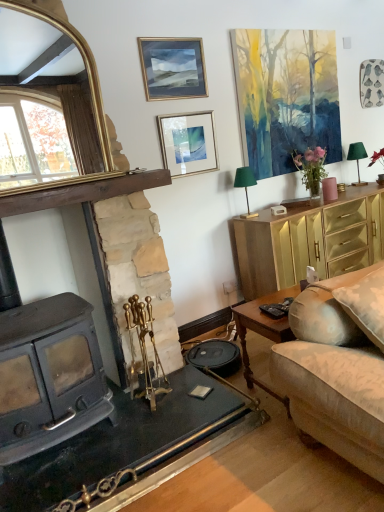
Looking at this image, measure the distance between black plastic remote control at lower right and camera.

A distance of 2.04 meters exists between black plastic remote control at lower right and camera.

Locate an element on the screen. black plastic remote control at lower right is located at coordinates (273, 310).

At what (x,y) coordinates should I click in order to perform the action: click on matte silver picture frame at upper center, which ranks as the second picture frame in left-to-right order. Please return your answer as a coordinate pair (x, y). Looking at the image, I should click on (188, 143).

What is the approximate width of pink matte vase at upper right?

The width of pink matte vase at upper right is 26.46 centimeters.

This screenshot has width=384, height=512. What do you see at coordinates (286, 96) in the screenshot? I see `watercolor painting at upper right, the third picture frame positioned from the left` at bounding box center [286, 96].

Locate an element on the screen. The height and width of the screenshot is (512, 384). watercolor painting at upper right, the first picture frame positioned from the right is located at coordinates (286, 96).

What do you see at coordinates (329, 189) in the screenshot?
I see `pink matte vase at upper right` at bounding box center [329, 189].

Identify the location of black plastic remote control at lower right. [273, 310].

Is gold metallic cabinet at right wider or thinner than gold-framed picture at upper center, marked as the third picture frame in a right-to-left arrangement?

Considering their sizes, gold metallic cabinet at right looks broader than gold-framed picture at upper center, marked as the third picture frame in a right-to-left arrangement.

Is gold metallic cabinet at right looking in the opposite direction of gold-framed picture at upper center, marked as the third picture frame in a right-to-left arrangement?

No.

Which is less distant, (256,242) or (147,55)?

Point (256,242).

Which is more to the right, gold metallic cabinet at right or pink matte vase at upper right?

From the viewer's perspective, gold metallic cabinet at right appears more on the right side.

How many degrees apart are the facing directions of gold metallic cabinet at right and pink matte vase at upper right?

There is a 0.527-degree angle between the facing directions of gold metallic cabinet at right and pink matte vase at upper right.

Which of these two, gold metallic cabinet at right or pink matte vase at upper right, is smaller?

With smaller size is pink matte vase at upper right.

Is gold metallic cabinet at right positioned far away from pink matte vase at upper right?

No, gold metallic cabinet at right is not far from pink matte vase at upper right.

Is wooden coffee table at lower right a part of gold-framed picture at upper center, marked as the third picture frame in a right-to-left arrangement?

No, wooden coffee table at lower right is not inside gold-framed picture at upper center, marked as the third picture frame in a right-to-left arrangement.

From the image's perspective, is gold-framed picture at upper center, which appears as the first picture frame when viewed from the left, on wooden coffee table at lower right?

Yes, from the image's perspective, gold-framed picture at upper center, which appears as the first picture frame when viewed from the left, is above wooden coffee table at lower right.

From the picture: Is gold-framed picture at upper center, which appears as the first picture frame when viewed from the left, turned away from wooden coffee table at lower right?

No, gold-framed picture at upper center, which appears as the first picture frame when viewed from the left,'s orientation is not away from wooden coffee table at lower right.

Can you confirm if gold-framed picture at upper center, marked as the third picture frame in a right-to-left arrangement, is taller than wooden coffee table at lower right?

In fact, gold-framed picture at upper center, marked as the third picture frame in a right-to-left arrangement, may be shorter than wooden coffee table at lower right.

This screenshot has height=512, width=384. Find the location of `the 3rd picture frame in front of the green fabric lampshade at upper right, placed as the first lamp when sorted from top to bottom, counting from the anchor's position`. the 3rd picture frame in front of the green fabric lampshade at upper right, placed as the first lamp when sorted from top to bottom, counting from the anchor's position is located at coordinates (173, 68).

From a real-world perspective, does gold-framed picture at upper center, which appears as the first picture frame when viewed from the left, sit lower than green fabric lampshade at upper right, the second lamp from the left?

No, from a real-world perspective, gold-framed picture at upper center, which appears as the first picture frame when viewed from the left, is not beneath green fabric lampshade at upper right, the second lamp from the left.

Is point (144, 76) closer or farther from the camera than point (352, 144)?

Point (144, 76).

Is matte silver picture frame at upper center, which appears as the second picture frame when viewed from the right, to the right of watercolor painting at upper right, the first picture frame positioned from the right, from the viewer's perspective?

No, matte silver picture frame at upper center, which appears as the second picture frame when viewed from the right, is not to the right of watercolor painting at upper right, the first picture frame positioned from the right.

Which of these two, matte silver picture frame at upper center, which appears as the second picture frame when viewed from the right, or watercolor painting at upper right, the first picture frame positioned from the right, stands shorter?

Standing shorter between the two is matte silver picture frame at upper center, which appears as the second picture frame when viewed from the right.

Is matte silver picture frame at upper center, which appears as the second picture frame when viewed from the right, facing towards watercolor painting at upper right, the third picture frame positioned from the left?

No.

From the watercolor painting at upper right, the third picture frame positioned from the left, count the 1st picture frame to the left and point to it. Please provide its 2D coordinates.

[(188, 143)]

From a real-world perspective, between black plastic remote control at lower right and watercolor painting at upper right, the first picture frame positioned from the right, who is vertically lower?

From a 3D spatial view, black plastic remote control at lower right is below.

Can you confirm if black plastic remote control at lower right is taller than watercolor painting at upper right, the third picture frame positioned from the left?

No.

Is black plastic remote control at lower right turned away from watercolor painting at upper right, the first picture frame positioned from the right?

No, black plastic remote control at lower right's orientation is not away from watercolor painting at upper right, the first picture frame positioned from the right.

In the scene shown: Is black plastic remote control at lower right directly adjacent to watercolor painting at upper right, the third picture frame positioned from the left?

No.

Is watercolor painting at upper right, the third picture frame positioned from the left, wider or thinner than matte black stove at left?

watercolor painting at upper right, the third picture frame positioned from the left, is thinner than matte black stove at left.

Does watercolor painting at upper right, the first picture frame positioned from the right, touch matte black stove at left?

No, watercolor painting at upper right, the first picture frame positioned from the right, is not making contact with matte black stove at left.

From the image's perspective, which picture frame is the 2nd one above the matte black stove at left? Please provide its 2D coordinates.

[(286, 96)]

Is watercolor painting at upper right, the first picture frame positioned from the right, inside the boundaries of matte black stove at left, or outside?

watercolor painting at upper right, the first picture frame positioned from the right, is located beyond the bounds of matte black stove at left.

Where is `the 2nd picture frame in front of the gold metallic cabinet at right, counting from the anchor's position`? the 2nd picture frame in front of the gold metallic cabinet at right, counting from the anchor's position is located at coordinates (173, 68).

Locate an element on the screen. flower on the left of gold metallic cabinet at right is located at coordinates (311, 168).

Which object lies nearer to the anchor point gold-framed picture at upper center, which appears as the first picture frame when viewed from the left, matte silver picture frame at upper center, which ranks as the second picture frame in left-to-right order, or gold/gilded mirror at upper left?

Among the two, matte silver picture frame at upper center, which ranks as the second picture frame in left-to-right order, is located nearer to gold-framed picture at upper center, which appears as the first picture frame when viewed from the left.

When comparing their distances from matte silver picture frame at upper center, which ranks as the second picture frame in left-to-right order, does gold metallic cabinet at right or black plastic remote control at lower right seem further?

The object further to matte silver picture frame at upper center, which ranks as the second picture frame in left-to-right order, is black plastic remote control at lower right.

Estimate the real-world distances between objects in this image. Which object is closer to pink matte vase at upper right, gold/gilded mirror at upper left or green fabric lampshade at upper right, which is the second lamp in bottom-to-top order?

green fabric lampshade at upper right, which is the second lamp in bottom-to-top order, is closer to pink matte vase at upper right.

Looking at the image, which one is located further to gold metallic cabinet at right, matte silver picture frame at upper center, which appears as the second picture frame when viewed from the right, or gold-framed picture at upper center, marked as the third picture frame in a right-to-left arrangement?

gold-framed picture at upper center, marked as the third picture frame in a right-to-left arrangement, lies further to gold metallic cabinet at right than the other object.

From the image, which object appears to be nearer to matte black stove at left, wooden coffee table at lower right or gold/gilded mirror at upper left?

Based on the image, gold/gilded mirror at upper left appears to be nearer to matte black stove at left.

When comparing their distances from gold metallic cabinet at right, does green fabric lampshade at upper right, the second lamp from the left, or matte silver picture frame at upper center, which ranks as the second picture frame in left-to-right order, seem closer?

The object closer to gold metallic cabinet at right is matte silver picture frame at upper center, which ranks as the second picture frame in left-to-right order.

Based on their spatial positions, is matte black stove at left or green fabric lampshade at upper right, acting as the 2th lamp starting from the back, closer to gold/gilded mirror at upper left?

matte black stove at left lies closer to gold/gilded mirror at upper left than the other object.

When comparing their distances from green fabric lampshade at upper right, acting as the 2th lamp starting from the right, does pink matte vase at upper right or wooden coffee table at lower right seem further?

wooden coffee table at lower right is positioned further to the anchor green fabric lampshade at upper right, acting as the 2th lamp starting from the right.

Locate an element on the screen. This screenshot has height=512, width=384. cabinetry between black plastic remote control at lower right and pink matte vase at upper right along the z-axis is located at coordinates (310, 241).

I want to click on flower between gold/gilded mirror at upper left and pink matte vase at upper right, so click(x=311, y=168).

Find the location of a particular element. The height and width of the screenshot is (512, 384). remote control between wooden coffee table at lower right and pink matte vase at upper right along the z-axis is located at coordinates (273, 310).

You are a GUI agent. You are given a task and a screenshot of the screen. Output one action in this format:
    pyautogui.click(x=<x>, y=<y>)
    Task: Click on the remote control between matte black stove at left and pink matte vase at upper right
    This screenshot has width=384, height=512.
    Given the screenshot: What is the action you would take?
    pyautogui.click(x=273, y=310)